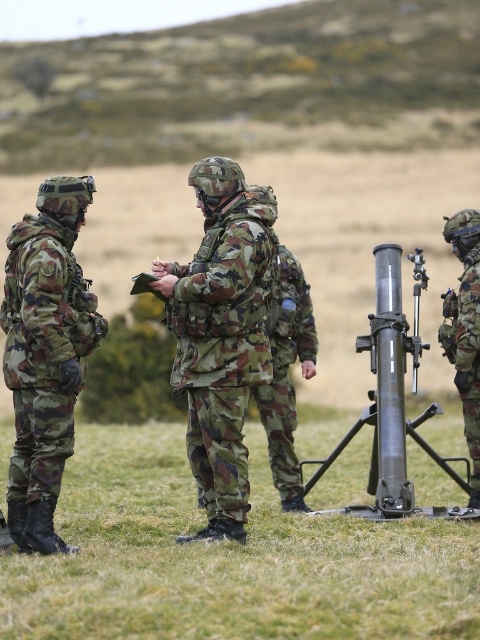
Question: Where is camouflage fabric uniform at center located in relation to camo fabric uniform at left in the image?

Choices:
 (A) left
 (B) right

Answer: (B)

Question: Which object is the farthest from the camouflage fabric helmet at right?

Choices:
 (A) matte black telescope at center
 (B) camo fabric uniform at left
 (C) camouflage fabric uniform at center

Answer: (B)

Question: Which point is farther to the camera?

Choices:
 (A) camouflage fabric uniform at center
 (B) matte black telescope at center

Answer: (B)

Question: Which of the following is the closest to the observer?

Choices:
 (A) matte black telescope at center
 (B) camo fabric uniform at left

Answer: (B)

Question: Is camouflage fabric uniform at center positioned before camouflage fabric helmet at right?

Choices:
 (A) no
 (B) yes

Answer: (B)

Question: Can you confirm if camouflage fabric uniform at center is positioned above camouflage fabric helmet at right?

Choices:
 (A) yes
 (B) no

Answer: (A)